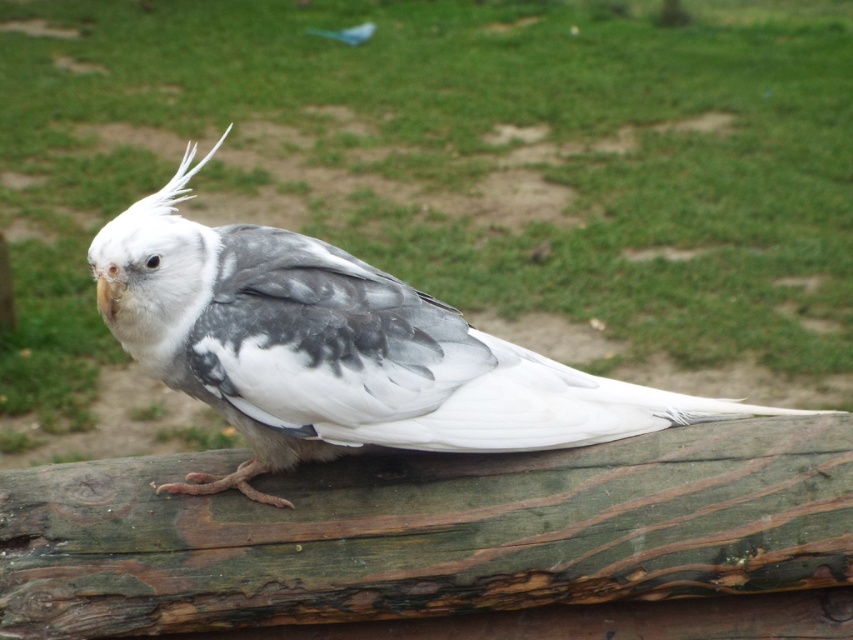
Can you confirm if weathered wood at center is positioned below white matte bird at center?

Yes, weathered wood at center is below white matte bird at center.

Is weathered wood at center behind white matte bird at center?

Yes.

Does point (849, 417) lie in front of point (180, 332)?

No, it is behind (180, 332).

Where is `weathered wood at center`? The width and height of the screenshot is (853, 640). weathered wood at center is located at coordinates (428, 531).